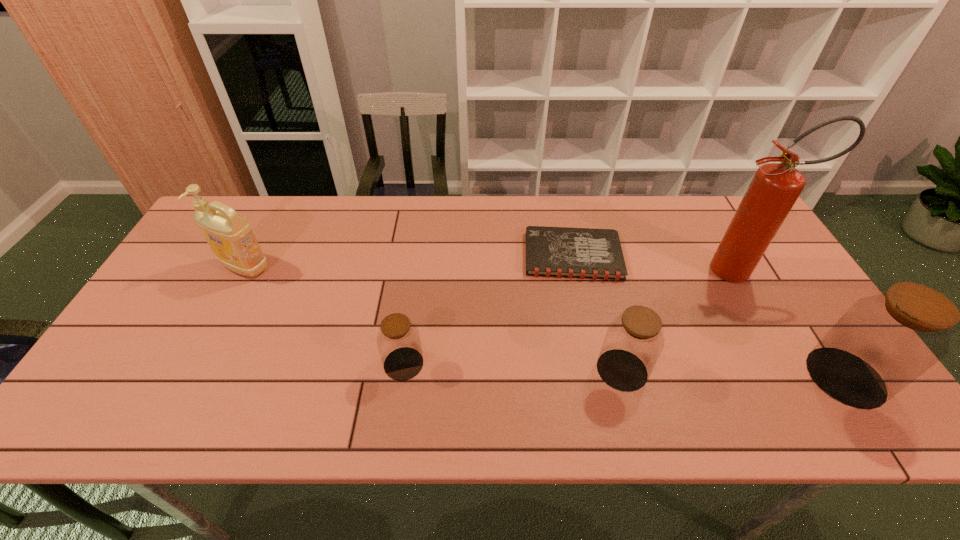
The image size is (960, 540). I want to click on the shortest jar, so click(x=398, y=340).

Locate an element on the screen. Image resolution: width=960 pixels, height=540 pixels. the leftmost jar is located at coordinates (398, 340).

Where is `the second shortest jar`? the second shortest jar is located at coordinates 634,340.

Locate an element on the screen. The image size is (960, 540). the fourth tallest object is located at coordinates (634, 340).

Where is `the tallest jar`? the tallest jar is located at coordinates (x=882, y=343).

Find the location of a particular element. This screenshot has width=960, height=540. the shortest object is located at coordinates (558, 252).

The height and width of the screenshot is (540, 960). I want to click on detergent, so click(x=229, y=235).

Locate an element on the screen. the tallest object is located at coordinates pyautogui.click(x=775, y=187).

The image size is (960, 540). I want to click on vacant area situated 0.110m on the left of the shortest jar, so click(x=338, y=363).

Where is `free point located on the left of the fourth tallest object`? This screenshot has height=540, width=960. free point located on the left of the fourth tallest object is located at coordinates (461, 370).